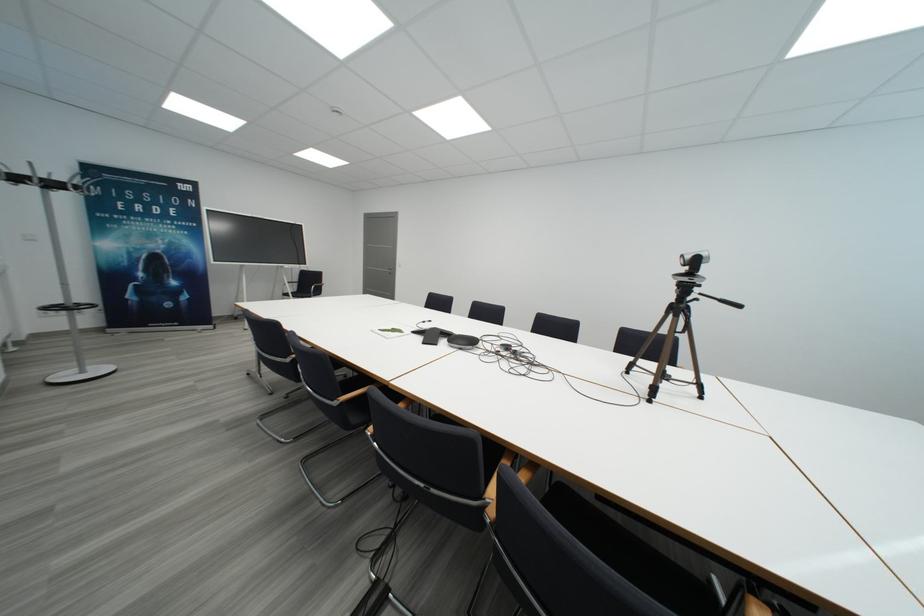
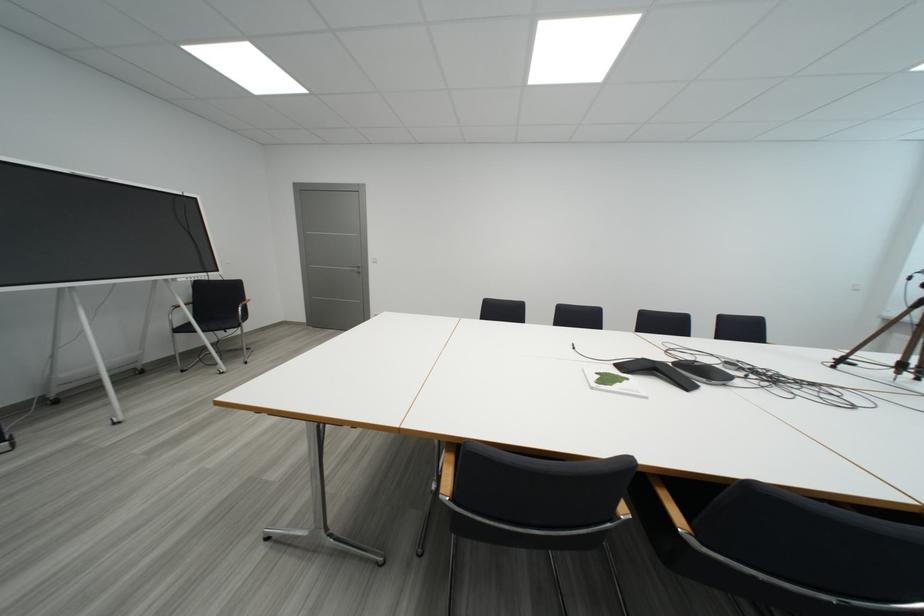
What movement of the cameraman would produce the second image?

The cameraman moved toward left, forward.